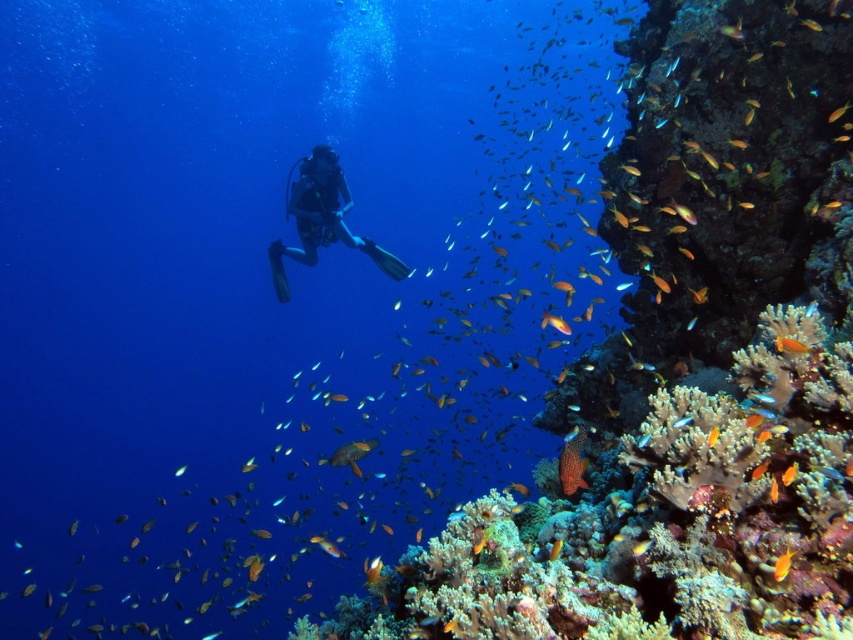
Where is `rough coral reef at right`? rough coral reef at right is located at coordinates (686, 369).

This screenshot has width=853, height=640. What are the coordinates of `rough coral reef at right` in the screenshot? It's located at (686, 369).

Which is more to the right, black scuba diver at center or orange coral at lower right?

orange coral at lower right

Locate an element on the screen. black scuba diver at center is located at coordinates (312, 214).

Locate an element on the screen. The width and height of the screenshot is (853, 640). black scuba diver at center is located at coordinates [312, 214].

Between rough coral reef at right and orange coral at lower right, which one appears on the left side from the viewer's perspective?

orange coral at lower right is more to the left.

Does rough coral reef at right appear over orange coral at lower right?

Yes.

Does point (564, 529) come in front of point (572, 476)?

Yes, point (564, 529) is in front of point (572, 476).

At what (x,y) coordinates should I click in order to perform the action: click on rough coral reef at right. Please return your answer as a coordinate pair (x, y). The image size is (853, 640). Looking at the image, I should click on (686, 369).